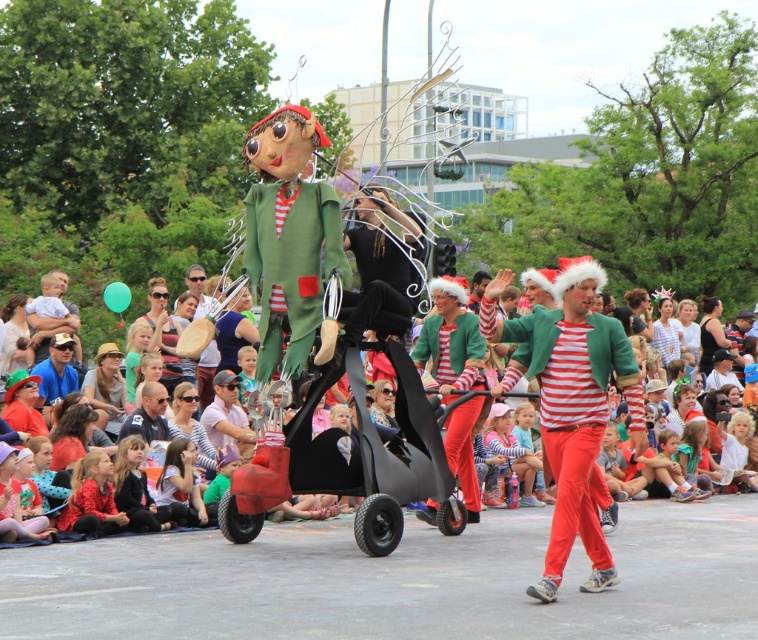
Question: Which of the following is the closest to the observer?

Choices:
 (A) (550, 308)
 (B) (321, 372)

Answer: (B)

Question: Does black matte monocycle at center appear over matte red pants at center?

Choices:
 (A) yes
 (B) no

Answer: (B)

Question: Observing the image, what is the correct spatial positioning of matte red pants at center in reference to brushed metal drum at center?

Choices:
 (A) below
 (B) above

Answer: (A)

Question: Does striped cotton shirt at center have a smaller size compared to black matte monocycle at center?

Choices:
 (A) no
 (B) yes

Answer: (A)

Question: Which point is closer to the camera taking this photo?

Choices:
 (A) (318, 472)
 (B) (619, 353)
 (C) (204, 381)
 (D) (412, 448)

Answer: (B)

Question: Among these points, which one is farthest from the camera?

Choices:
 (A) (381, 538)
 (B) (299, 470)
 (C) (572, 468)

Answer: (B)